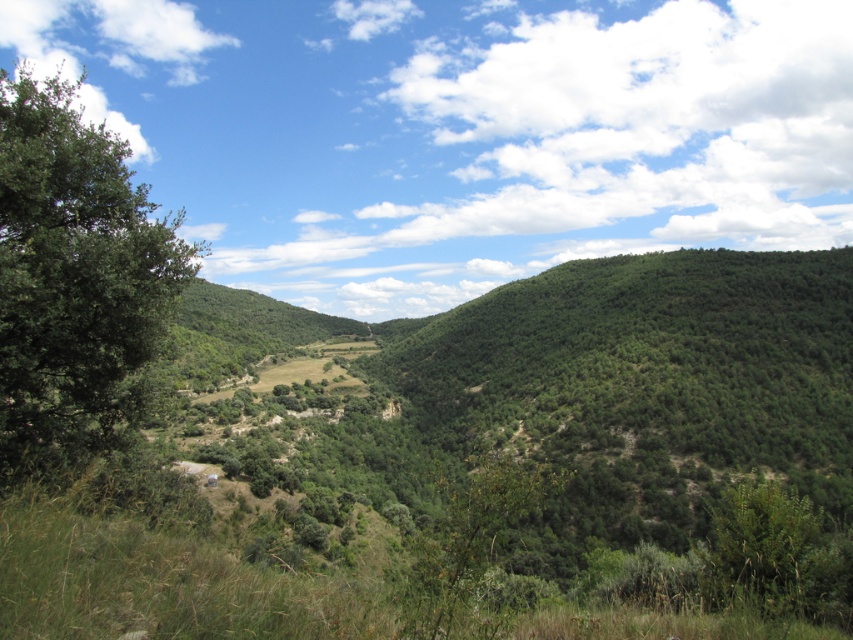
Can you confirm if green leafy shrub at lower right is smaller than green leafy shrub at center?

Correct, green leafy shrub at lower right occupies less space than green leafy shrub at center.

Does green leafy shrub at lower right appear over green leafy shrub at center?

Yes, green leafy shrub at lower right is above green leafy shrub at center.

Is point (740, 490) positioned in front of point (564, 476)?

Yes, it is.

You are a GUI agent. You are given a task and a screenshot of the screen. Output one action in this format:
    pyautogui.click(x=<x>, y=<y>)
    Task: Click on the green leafy shrub at lower right
    
    Given the screenshot: What is the action you would take?
    pyautogui.click(x=776, y=554)

Is point (83, 276) positioned behind point (543, 472)?

No, it is not.

Describe the element at coordinates (74, 280) in the screenshot. The width and height of the screenshot is (853, 640). I see `green leafy tree at left` at that location.

Which is behind, point (24, 356) or point (457, 480)?

The point (457, 480) is more distant.

Find the location of a particular element. This screenshot has height=640, width=853. green leafy tree at left is located at coordinates (74, 280).

Describe the element at coordinates (74, 280) in the screenshot. The height and width of the screenshot is (640, 853). I see `green leafy tree at left` at that location.

Can you confirm if green leafy tree at left is positioned to the left of green leafy shrub at lower right?

Yes, green leafy tree at left is to the left of green leafy shrub at lower right.

What do you see at coordinates (74, 280) in the screenshot? The width and height of the screenshot is (853, 640). I see `green leafy tree at left` at bounding box center [74, 280].

At what (x,y) coordinates should I click in order to perform the action: click on green leafy tree at left. Please return your answer as a coordinate pair (x, y). Image resolution: width=853 pixels, height=640 pixels. Looking at the image, I should click on (74, 280).